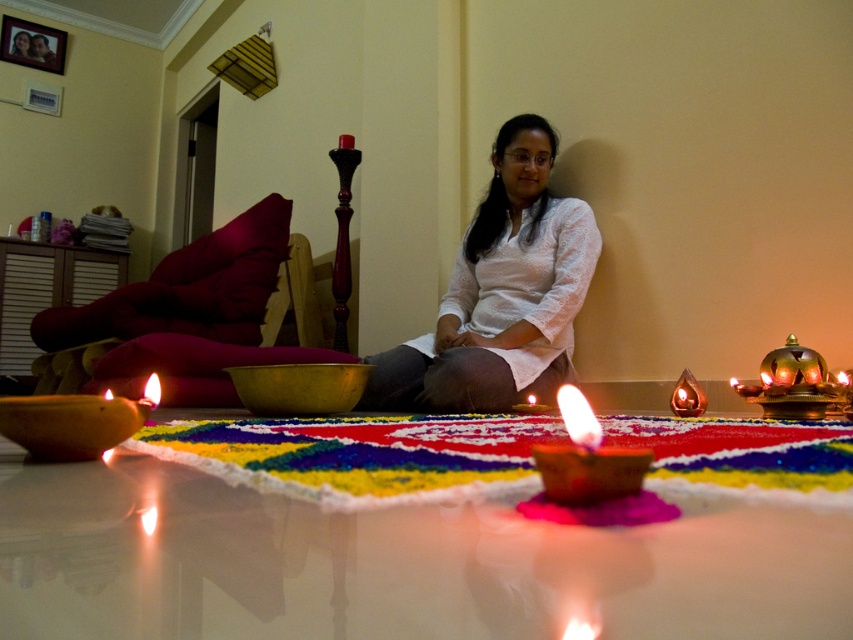
Question: Does metallic gold lampshade at upper center appear under matte black candle at center?

Choices:
 (A) yes
 (B) no

Answer: (B)

Question: Which point is closer to the camera taking this photo?

Choices:
 (A) (505, 132)
 (B) (590, 436)
 (C) (271, 51)
 (D) (345, 145)

Answer: (B)

Question: Does white textured shirt at center lie behind metallic gold lampshade at upper center?

Choices:
 (A) yes
 (B) no

Answer: (B)

Question: Which object is closer to the camera taking this photo?

Choices:
 (A) matte gold candle at center
 (B) white textured shirt at center
 (C) metallic gold lampshade at upper center
 (D) matte black candle at center

Answer: (A)

Question: Does metallic gold lampshade at upper center come in front of matte gold candle at center?

Choices:
 (A) no
 (B) yes

Answer: (A)

Question: Which point is farther to the camera?

Choices:
 (A) (535, 400)
 (B) (477, 372)
 (C) (351, 138)

Answer: (C)